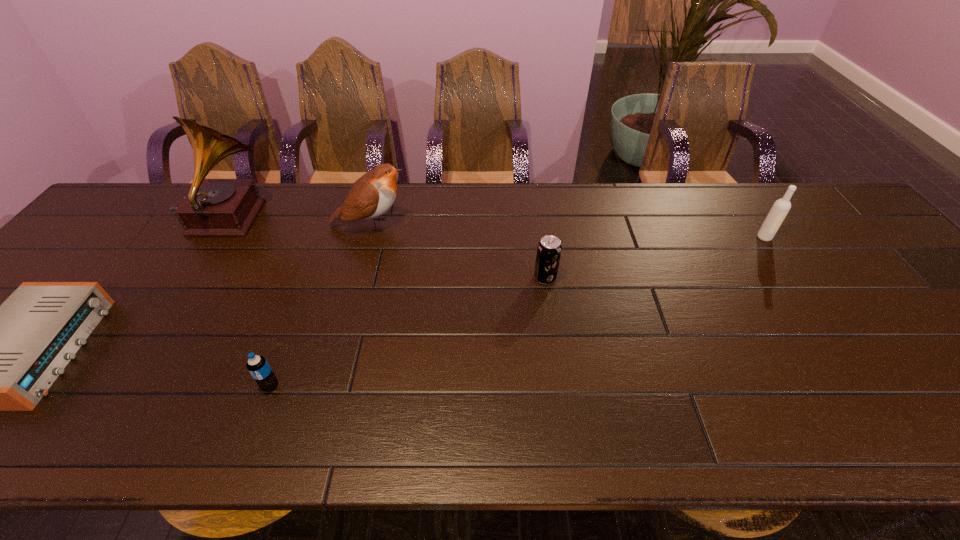
This screenshot has height=540, width=960. I want to click on free spot between the bird and the left soda bottle, so click(321, 305).

Locate an element on the screen. free space between the nearer soda bottle and the phonograph record is located at coordinates (249, 303).

The width and height of the screenshot is (960, 540). I want to click on vacant area that lies between the right soda bottle and the bird, so click(458, 251).

This screenshot has width=960, height=540. I want to click on free space between the vodka and the phonograph record, so (495, 228).

Where is `vacant space that's between the tallest object and the farther soda bottle`? This screenshot has height=540, width=960. vacant space that's between the tallest object and the farther soda bottle is located at coordinates (386, 249).

Where is `vacant space that is in between the bird and the tallest object`? The image size is (960, 540). vacant space that is in between the bird and the tallest object is located at coordinates (298, 222).

Locate an element on the screen. object that can be found as the third closest to the radio receiver is located at coordinates click(372, 195).

Identify which object is located as the third nearest to the bird. Please provide its 2D coordinates. Your answer should be formatted as a tuple, i.e. [(x, y)], where the tuple contains the x and y coordinates of a point satisfying the conditions above.

[(257, 365)]

Identify the location of vacant area in the image that satisfies the following two spatial constraints: 1. at the face of the bird; 2. on the front side of the nearer soda bottle. (326, 386).

Find the location of a particular element. vacant region that satisfies the following two spatial constraints: 1. from the horn of the tallest object; 2. on the left side of the rightmost object is located at coordinates (215, 238).